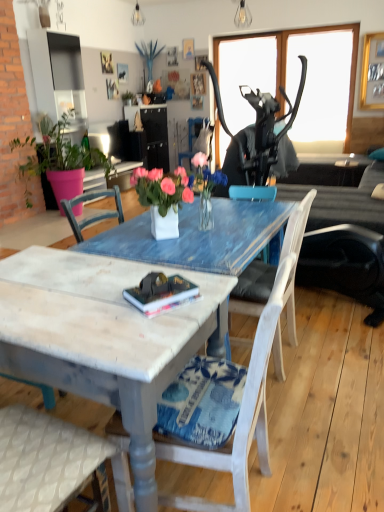
Question: From the image's perspective, is matte black side table at right positioned above or below dark gray fabric couch at center?

Choices:
 (A) above
 (B) below

Answer: (A)

Question: Is point (339, 169) closer or farther from the camera than point (372, 211)?

Choices:
 (A) farther
 (B) closer

Answer: (A)

Question: Which is farther from the matte black lampshade at upper center, which is the second lamp in front-to-back order?

Choices:
 (A) transparent glass window screen at upper right
 (B) hardcover book at center
 (C) white fabric pillow at right
 (D) white painted wood chair at center, the 1th chair viewed from the front
 (E) matte blue vase at upper center

Answer: (D)

Question: Estimate the real-world distances between objects in this image. Which object is farther from the white painted wood chair at center, the 1th chair viewed from the front?

Choices:
 (A) white wood chair at center, arranged as the second chair when viewed from the top
 (B) matte black lampshade at upper center, acting as the 1th lamp starting from the top
 (C) dark gray fabric couch at center
 (D) white wood chair at center, acting as the first chair starting from the back
 (E) hardcover book at center

Answer: (B)